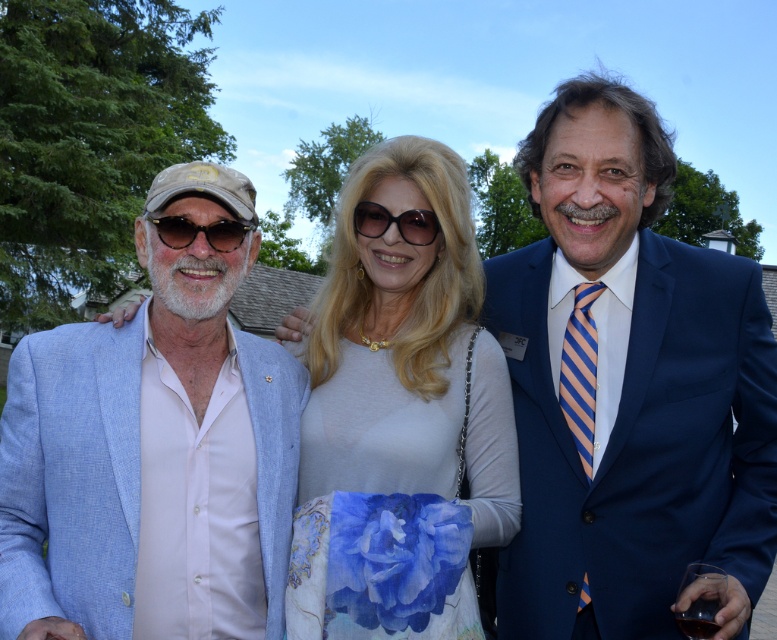
Does point (180, 392) come farther from viewer compared to point (706, 604)?

Yes, point (180, 392) is behind point (706, 604).

Between light blue linen suit at left and transparent glass at center, which one has more height?

light blue linen suit at left is taller.

Does point (12, 365) come closer to viewer compared to point (695, 628)?

No.

Locate an element on the screen. This screenshot has height=640, width=777. light blue linen suit at left is located at coordinates (152, 451).

This screenshot has height=640, width=777. What do you see at coordinates (152, 451) in the screenshot?
I see `light blue linen suit at left` at bounding box center [152, 451].

Can you confirm if light blue linen suit at left is positioned to the right of black plastic sunglasses at center?

No, light blue linen suit at left is not to the right of black plastic sunglasses at center.

Identify the location of light blue linen suit at left. (152, 451).

Find the location of a particular element. light blue linen suit at left is located at coordinates (152, 451).

Between light blue linen suit at left and white silk blouse at center, which one is positioned higher?

white silk blouse at center is higher up.

What do you see at coordinates (152, 451) in the screenshot? The width and height of the screenshot is (777, 640). I see `light blue linen suit at left` at bounding box center [152, 451].

The width and height of the screenshot is (777, 640). I want to click on light blue linen suit at left, so click(x=152, y=451).